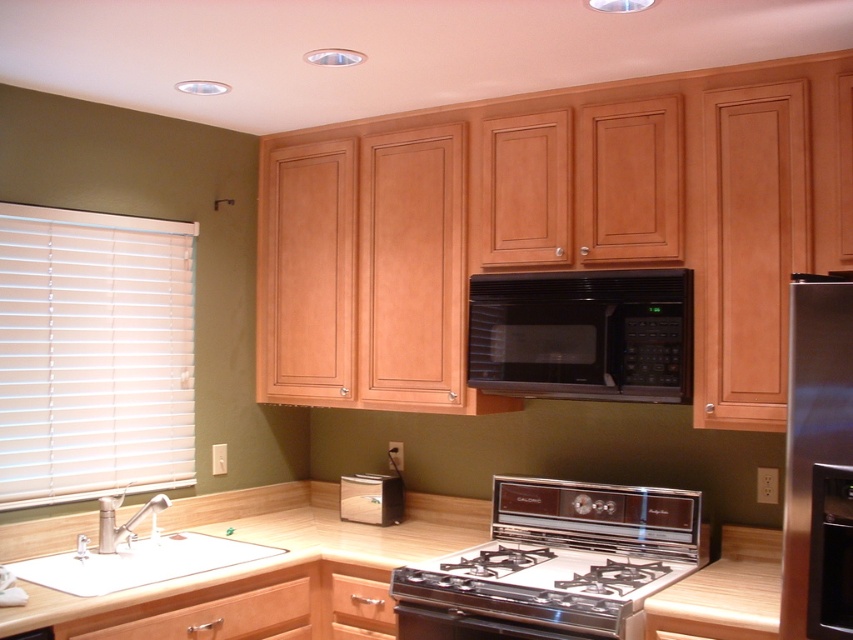
Measure the distance between shiny silver gas stove at center and camera.

7.48 feet

Who is taller, shiny silver gas stove at center or brushed metal toaster at lower center?

Standing taller between the two is shiny silver gas stove at center.

Measure the distance between shiny silver gas stove at center and camera.

2.28 meters

Where is `shiny silver gas stove at center`? shiny silver gas stove at center is located at coordinates (555, 563).

Is point (529, 589) more distant than point (184, 561)?

No, (529, 589) is in front of (184, 561).

Does black stainless steel gas stove at center appear over white glossy sink at lower left?

No, black stainless steel gas stove at center is not above white glossy sink at lower left.

The image size is (853, 640). Identify the location of black stainless steel gas stove at center. (538, 582).

In order to click on black stainless steel gas stove at center in this screenshot , I will do `click(538, 582)`.

Does wooden at lower center appear on the left side of silver metallic faucet at sink left?

No, wooden at lower center is not to the left of silver metallic faucet at sink left.

Is wooden at lower center to the right of silver metallic faucet at sink left from the viewer's perspective?

Yes, wooden at lower center is to the right of silver metallic faucet at sink left.

Is point (386, 568) farther from viewer compared to point (109, 531)?

No, it is in front of (109, 531).

You are a GUI agent. You are given a task and a screenshot of the screen. Output one action in this format:
    pyautogui.click(x=<x>, y=<y>)
    Task: Click on the wooden at lower center
    This screenshot has height=640, width=853.
    Given the screenshot: What is the action you would take?
    pyautogui.click(x=270, y=557)